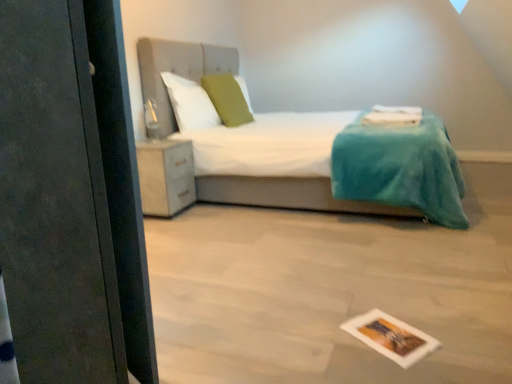
Identify the location of blank space situated above printed paper postcard at lower center (from a real-world perspective). (388, 332).